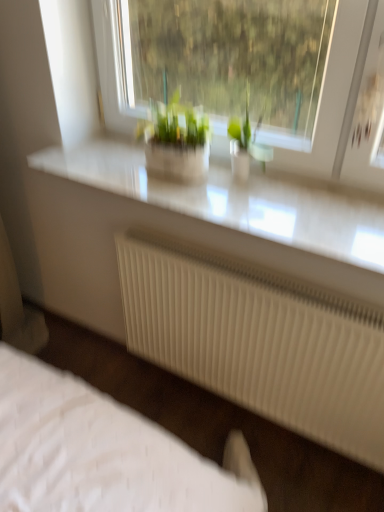
Identify the location of vacant area on top of white ribbed radiator at lower center (from a real-world perspective). (255, 268).